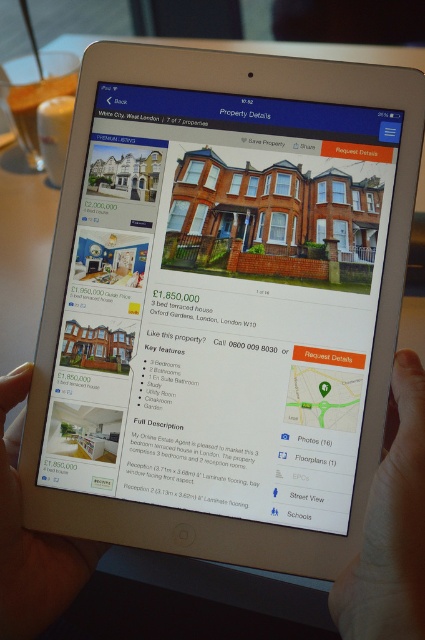
You are a real estate agent holding a tablet and a client wants to know if there is enough space between your hand and the tablet to place a business card. The business card is 3.5 inches long. Can you fit the card between your smooth skin hand at lower right and the matte black tablet at lower left?

The smooth skin hand at lower right and the matte black tablet at lower left are 9.53 inches apart from each other. Since the business card is only 3.5 inches long, there is sufficient space to place it between them.

When looking at the tablet screen, which of the two points, point 1 at coordinates (410, 456) or point 2 at (11, 586), appears closer to the viewer?

Point 1 at coordinates (410, 456) appears closer to the viewer because it is closer to the camera than point 2 at (11, 586).